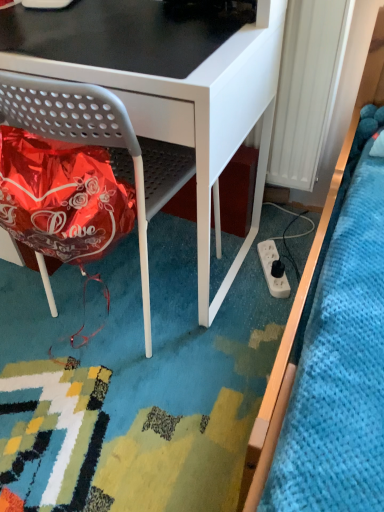
The height and width of the screenshot is (512, 384). What are the coordinates of `vacant space to the right of matte gray chair at lower left` in the screenshot? It's located at (244, 286).